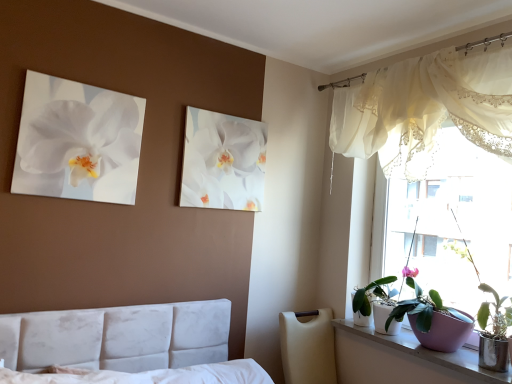
The width and height of the screenshot is (512, 384). What do you see at coordinates (83, 137) in the screenshot?
I see `white glossy orchid at upper left, the second flower viewed from the back` at bounding box center [83, 137].

Image resolution: width=512 pixels, height=384 pixels. Describe the element at coordinates (432, 318) in the screenshot. I see `purple ceramic pot at window, the 2th houseplant in the back-to-front sequence` at that location.

This screenshot has width=512, height=384. What do you see at coordinates (402, 359) in the screenshot?
I see `smooth white windowsill at lower right` at bounding box center [402, 359].

This screenshot has height=384, width=512. What do you see at coordinates (224, 163) in the screenshot?
I see `white glossy orchid at upper center, the 1th flower when ordered from right to left` at bounding box center [224, 163].

Image resolution: width=512 pixels, height=384 pixels. What do you see at coordinates (492, 327) in the screenshot?
I see `purple ceramic pot at window, which is the third houseplant in back-to-front order` at bounding box center [492, 327].

The image size is (512, 384). Identify the location of purple ceramic pot at window, which is the third houseplant in back-to-front order. (492, 327).

Describe the element at coordinates (372, 293) in the screenshot. I see `white glossy pot at window, arranged as the first houseplant when viewed from the back` at that location.

Identify the location of white glossy pot at window, arranged as the first houseplant when viewed from the back. 372,293.

This screenshot has height=384, width=512. I want to click on translucent fabric at upper right, so click(453, 223).

From a real-world perspective, is smooth white windowsill at lower right physically located above or below purple ceramic pot at window, which appears as the first houseplant when viewed from the front?

From a real-world perspective, smooth white windowsill at lower right is physically below purple ceramic pot at window, which appears as the first houseplant when viewed from the front.

Considering the sizes of objects smooth white windowsill at lower right and purple ceramic pot at window, which is the third houseplant in back-to-front order, in the image provided, who is thinner, smooth white windowsill at lower right or purple ceramic pot at window, which is the third houseplant in back-to-front order,?

With smaller width is purple ceramic pot at window, which is the third houseplant in back-to-front order.

From the image's perspective, is smooth white windowsill at lower right above or below purple ceramic pot at window, which is the third houseplant in back-to-front order?

Clearly, from the image's perspective, smooth white windowsill at lower right is below purple ceramic pot at window, which is the third houseplant in back-to-front order.

Who is taller, purple ceramic pot at window, which appears as the first houseplant when viewed from the front, or purple ceramic pot at window, which is counted as the second houseplant, starting from the front?

Standing taller between the two is purple ceramic pot at window, which appears as the first houseplant when viewed from the front.

Between point (495, 360) and point (473, 319), which one is positioned behind?

The point (473, 319) is behind.

Is the depth of purple ceramic pot at window, which appears as the first houseplant when viewed from the front, greater than that of purple ceramic pot at window, which is counted as the second houseplant, starting from the front?

No, purple ceramic pot at window, which appears as the first houseplant when viewed from the front, is closer to the viewer.

Is white glossy orchid at upper left, the 1th flower positioned from the front, further to the viewer compared to white glossy pot at window, arranged as the first houseplant when viewed from the back?

No, it is not.

Is white glossy orchid at upper left, which is counted as the 2th flower, starting from the right, bigger or smaller than white glossy pot at window, arranged as the first houseplant when viewed from the back?

white glossy orchid at upper left, which is counted as the 2th flower, starting from the right, is smaller than white glossy pot at window, arranged as the first houseplant when viewed from the back.

From a real-world perspective, is white glossy orchid at upper left, placed as the 1th flower when sorted from left to right, physically below white glossy pot at window, arranged as the first houseplant when viewed from the back?

No, from a real-world perspective, white glossy orchid at upper left, placed as the 1th flower when sorted from left to right, is not below white glossy pot at window, arranged as the first houseplant when viewed from the back.

How different are the orientations of white glossy orchid at upper left, the 1th flower positioned from the front, and white glossy pot at window, arranged as the first houseplant when viewed from the back, in degrees?

There is a 88.6-degree angle between the facing directions of white glossy orchid at upper left, the 1th flower positioned from the front, and white glossy pot at window, arranged as the first houseplant when viewed from the back.

Measure the distance between purple ceramic pot at window, which appears as the first houseplant when viewed from the front, and white glossy pot at window, arranged as the first houseplant when viewed from the back.

purple ceramic pot at window, which appears as the first houseplant when viewed from the front, is 18.79 inches from white glossy pot at window, arranged as the first houseplant when viewed from the back.

Considering the positions of objects purple ceramic pot at window, which appears as the first houseplant when viewed from the front, and white glossy pot at window, arranged as the first houseplant when viewed from the back, in the image provided, who is more to the left, purple ceramic pot at window, which appears as the first houseplant when viewed from the front, or white glossy pot at window, arranged as the first houseplant when viewed from the back,?

white glossy pot at window, arranged as the first houseplant when viewed from the back, is more to the left.

Is there a large distance between purple ceramic pot at window, which is the third houseplant in back-to-front order, and white glossy pot at window, arranged as the first houseplant when viewed from the back?

purple ceramic pot at window, which is the third houseplant in back-to-front order, is actually quite close to white glossy pot at window, arranged as the first houseplant when viewed from the back.

From the image's perspective, between purple ceramic pot at window, which is the third houseplant in back-to-front order, and white glossy pot at window, arranged as the first houseplant when viewed from the back, which one is located above?

From the image's view, purple ceramic pot at window, which is the third houseplant in back-to-front order, is above.

Would you consider sheer white curtain at upper right to be distant from translucent fabric at upper right?

No, sheer white curtain at upper right is not far from translucent fabric at upper right.

Between sheer white curtain at upper right and translucent fabric at upper right, which one appears on the right side from the viewer's perspective?

Positioned to the right is translucent fabric at upper right.

Is sheer white curtain at upper right in front of or behind translucent fabric at upper right in the image?

sheer white curtain at upper right is positioned closer to the viewer than translucent fabric at upper right.

Considering the relative sizes of sheer white curtain at upper right and translucent fabric at upper right in the image provided, is sheer white curtain at upper right taller than translucent fabric at upper right?

No.

Is white glossy pot at window, the third houseplant in the front-to-back sequence, to the left of smooth white windowsill at lower right from the viewer's perspective?

Correct, you'll find white glossy pot at window, the third houseplant in the front-to-back sequence, to the left of smooth white windowsill at lower right.

Is white glossy pot at window, arranged as the first houseplant when viewed from the back, wider than smooth white windowsill at lower right?

No, white glossy pot at window, arranged as the first houseplant when viewed from the back, is not wider than smooth white windowsill at lower right.

Where is `window sill lying on the right of white glossy pot at window, the third houseplant in the front-to-back sequence`? The height and width of the screenshot is (384, 512). window sill lying on the right of white glossy pot at window, the third houseplant in the front-to-back sequence is located at coordinates (402, 359).

Is white glossy pot at window, arranged as the first houseplant when viewed from the back, positioned before smooth white windowsill at lower right?

No, it is behind smooth white windowsill at lower right.

From a real-world perspective, is white glossy pot at window, arranged as the first houseplant when viewed from the back, physically below purple ceramic pot at window, which is the third houseplant in back-to-front order?

Correct, in the physical world, white glossy pot at window, arranged as the first houseplant when viewed from the back, is lower than purple ceramic pot at window, which is the third houseplant in back-to-front order.

Identify the location of the 2nd houseplant in front of the white glossy pot at window, arranged as the first houseplant when viewed from the back. This screenshot has width=512, height=384. (492, 327).

From the image's perspective, between white glossy pot at window, arranged as the first houseplant when viewed from the back, and purple ceramic pot at window, which appears as the first houseplant when viewed from the front, which one is located above?

purple ceramic pot at window, which appears as the first houseplant when viewed from the front.

Looking at their sizes, would you say white glossy pot at window, arranged as the first houseplant when viewed from the back, is wider or thinner than purple ceramic pot at window, which appears as the first houseplant when viewed from the front?

Considering their sizes, white glossy pot at window, arranged as the first houseplant when viewed from the back, looks slimmer than purple ceramic pot at window, which appears as the first houseplant when viewed from the front.

There is a smooth white windowsill at lower right. Identify the location of the 3rd houseplant above it (from the image's perspective). (492, 327).

At what (x,y) coordinates should I click in order to perform the action: click on houseplant located in front of the purple ceramic pot at window, which is counted as the second houseplant, starting from the front. Please return your answer as a coordinate pair (x, y). This screenshot has width=512, height=384. Looking at the image, I should click on pos(492,327).

Considering their positions, is purple ceramic pot at window, which is the third houseplant in back-to-front order, positioned further to white glossy orchid at upper center, the 1th flower when ordered from right to left, than translucent fabric at upper right?

The object further to white glossy orchid at upper center, the 1th flower when ordered from right to left, is purple ceramic pot at window, which is the third houseplant in back-to-front order.

Considering their positions, is purple ceramic pot at window, the 2th houseplant in the back-to-front sequence, positioned closer to white glossy orchid at upper center, the 1th flower when ordered from right to left, than sheer white curtain at upper right?

sheer white curtain at upper right is positioned closer to the anchor white glossy orchid at upper center, the 1th flower when ordered from right to left.

Considering their positions, is white glossy orchid at upper center, which appears as the first flower when viewed from the back, positioned further to white glossy orchid at upper left, placed as the 1th flower when sorted from left to right, than sheer white curtain at upper right?

The object further to white glossy orchid at upper left, placed as the 1th flower when sorted from left to right, is sheer white curtain at upper right.

Based on their spatial positions, is smooth white windowsill at lower right or purple ceramic pot at window, which appears as the first houseplant when viewed from the front, closer to white glossy orchid at upper center, which appears as the first flower when viewed from the back?

Among the two, smooth white windowsill at lower right is located nearer to white glossy orchid at upper center, which appears as the first flower when viewed from the back.

Looking at this image, looking at the image, which one is located closer to translucent fabric at upper right, smooth white windowsill at lower right or purple ceramic pot at window, which is counted as the second houseplant, starting from the front?

purple ceramic pot at window, which is counted as the second houseplant, starting from the front, lies closer to translucent fabric at upper right than the other object.

Estimate the real-world distances between objects in this image. Which object is further from white glossy pot at window, arranged as the first houseplant when viewed from the back, smooth white windowsill at lower right or purple ceramic pot at window, which appears as the first houseplant when viewed from the front?

purple ceramic pot at window, which appears as the first houseplant when viewed from the front.

When comparing their distances from sheer white curtain at upper right, does purple ceramic pot at window, the 2th houseplant in the back-to-front sequence, or white glossy orchid at upper center, the second flower when ordered from left to right, seem closer?

The object closer to sheer white curtain at upper right is white glossy orchid at upper center, the second flower when ordered from left to right.

Estimate the real-world distances between objects in this image. Which object is further from white glossy pot at window, arranged as the first houseplant when viewed from the back, translucent fabric at upper right or white glossy orchid at upper center, the second flower when ordered from left to right?

Among the two, white glossy orchid at upper center, the second flower when ordered from left to right, is located further to white glossy pot at window, arranged as the first houseplant when viewed from the back.

Locate an element on the screen. The height and width of the screenshot is (384, 512). window sill situated between white glossy orchid at upper left, the second flower viewed from the back, and purple ceramic pot at window, which appears as the first houseplant when viewed from the front, from left to right is located at coordinates (402, 359).

Identify the location of window between white glossy orchid at upper center, which appears as the first flower when viewed from the back, and purple ceramic pot at window, which is the third houseplant in back-to-front order. The width and height of the screenshot is (512, 384). (453, 223).

The width and height of the screenshot is (512, 384). In order to click on window between sheer white curtain at upper right and purple ceramic pot at window, which is counted as the second houseplant, starting from the front, in the up-down direction in this screenshot , I will do (453, 223).

Where is `flower situated between white glossy orchid at upper left, which is counted as the 2th flower, starting from the right, and translucent fabric at upper right from left to right`? The width and height of the screenshot is (512, 384). flower situated between white glossy orchid at upper left, which is counted as the 2th flower, starting from the right, and translucent fabric at upper right from left to right is located at coordinates (224, 163).